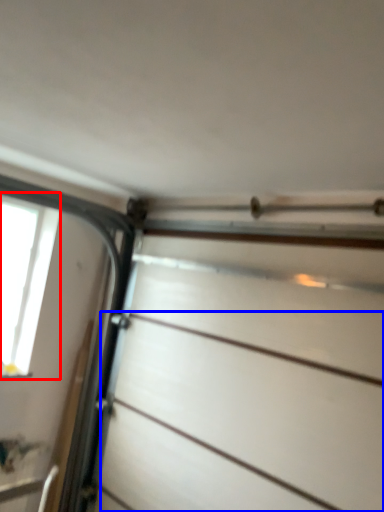
Question: Which object appears closest to the camera in this image, window (highlighted by a red box) or drawer (highlighted by a blue box)?

Choices:
 (A) window
 (B) drawer

Answer: (B)